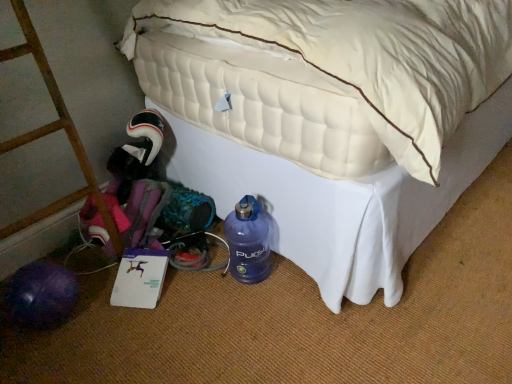
Question: Are blue matte water bottle at lower center and white quilted mattress at lower left making contact?

Choices:
 (A) yes
 (B) no

Answer: (B)

Question: Considering the relative positions of blue matte water bottle at lower center and white quilted mattress at lower left in the image provided, is blue matte water bottle at lower center to the right of white quilted mattress at lower left from the viewer's perspective?

Choices:
 (A) yes
 (B) no

Answer: (B)

Question: From a real-world perspective, is blue matte water bottle at lower center under white quilted mattress at lower left?

Choices:
 (A) yes
 (B) no

Answer: (A)

Question: Does blue matte water bottle at lower center lie in front of white quilted mattress at lower left?

Choices:
 (A) yes
 (B) no

Answer: (B)

Question: Does blue matte water bottle at lower center have a larger size compared to white quilted mattress at lower left?

Choices:
 (A) no
 (B) yes

Answer: (A)

Question: Is blue matte water bottle at lower center oriented towards white quilted mattress at lower left?

Choices:
 (A) yes
 (B) no

Answer: (B)

Question: Could you tell me if white quilted mattress at lower left is facing brushed metal ladder at left?

Choices:
 (A) yes
 (B) no

Answer: (A)

Question: Does white quilted mattress at lower left have a larger size compared to brushed metal ladder at left?

Choices:
 (A) yes
 (B) no

Answer: (A)

Question: Considering the relative sizes of white quilted mattress at lower left and brushed metal ladder at left in the image provided, is white quilted mattress at lower left taller than brushed metal ladder at left?

Choices:
 (A) no
 (B) yes

Answer: (B)

Question: Is white quilted mattress at lower left at the right side of brushed metal ladder at left?

Choices:
 (A) no
 (B) yes

Answer: (B)

Question: Can you confirm if white quilted mattress at lower left is shorter than brushed metal ladder at left?

Choices:
 (A) no
 (B) yes

Answer: (A)

Question: From the image's perspective, is white quilted mattress at lower left beneath brushed metal ladder at left?

Choices:
 (A) no
 (B) yes

Answer: (A)

Question: Considering the relative positions of brushed metal ladder at left and white quilted mattress at lower left in the image provided, is brushed metal ladder at left to the left of white quilted mattress at lower left from the viewer's perspective?

Choices:
 (A) yes
 (B) no

Answer: (A)